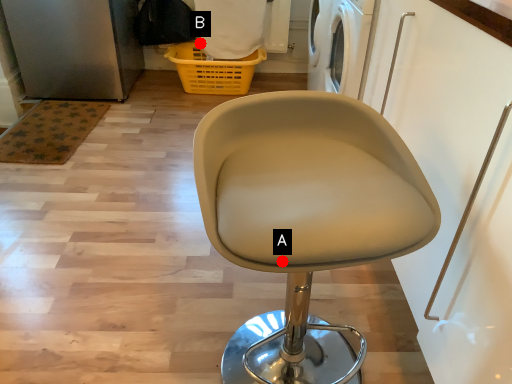
Question: Two points are circled on the image, labeled by A and B beside each circle. Which of the following is the closest to the observer?

Choices:
 (A) A is closer
 (B) B is closer

Answer: (A)